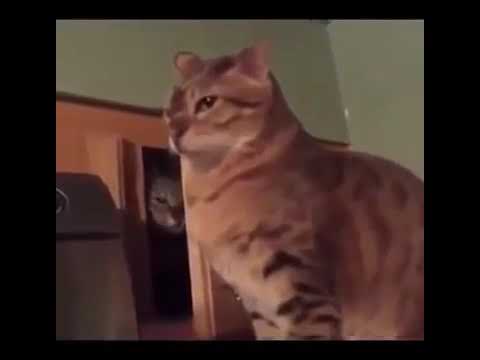
This screenshot has height=360, width=480. In order to click on wall in this screenshot , I will do `click(116, 60)`, `click(389, 96)`.